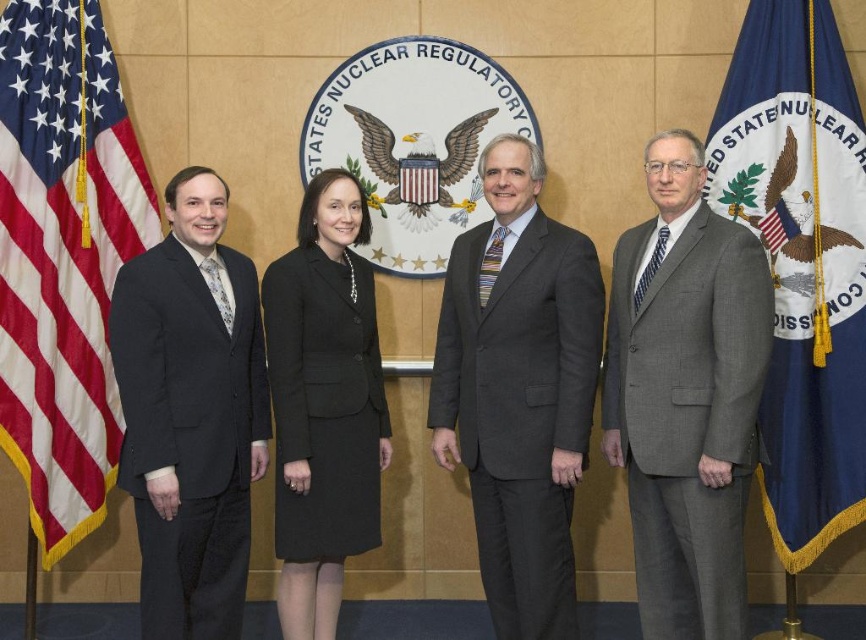
Question: Estimate the real-world distances between objects in this image. Which object is closer to the gray wool suit at right?

Choices:
 (A) black wool skirt at center
 (B) gold textured eagle at center

Answer: (A)

Question: Which of the following is the farthest from the observer?

Choices:
 (A) (204, 560)
 (B) (492, 298)

Answer: (A)

Question: Which point is closer to the camera taking this photo?

Choices:
 (A) (810, 324)
 (B) (427, 156)
 (C) (644, 278)
 (D) (380, 436)

Answer: (C)

Question: Does gray wool suit at right appear on the left side of silver metallic eagle at right?

Choices:
 (A) no
 (B) yes

Answer: (B)

Question: Does american flag at left appear under gold textured eagle at center?

Choices:
 (A) yes
 (B) no

Answer: (A)

Question: Does blue fabric flag at right have a larger size compared to matte black suit at left?

Choices:
 (A) no
 (B) yes

Answer: (A)